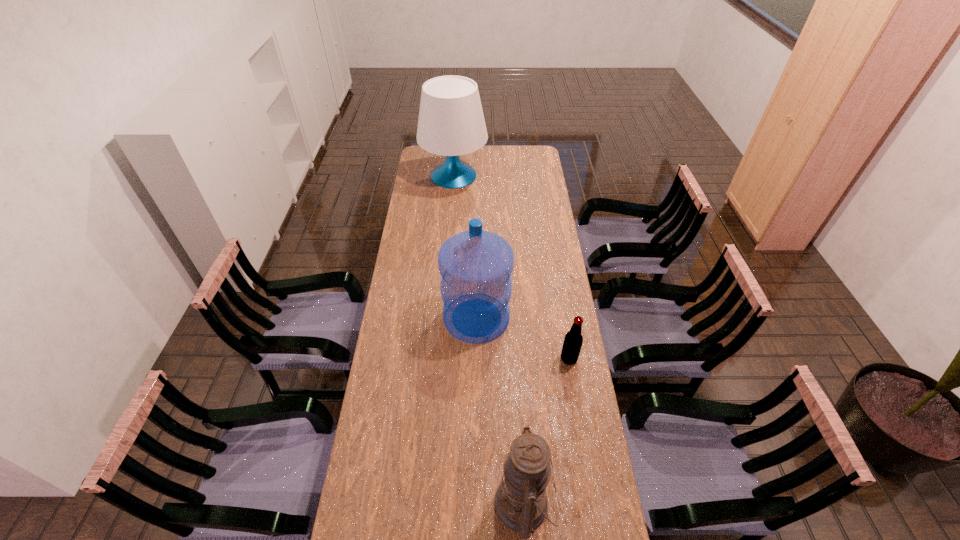
This screenshot has height=540, width=960. Find the location of `object that is at the far left corner`. object that is at the far left corner is located at coordinates (451, 122).

You are a GUI agent. You are given a task and a screenshot of the screen. Output one action in this format:
    pyautogui.click(x=<x>, y=<y>)
    Task: Click on the vacant space at the far edge of the desktop
    
    Given the screenshot: What is the action you would take?
    pyautogui.click(x=471, y=163)

Find the location of a particular element. The image size is (960, 540). free space at the left edge of the desktop is located at coordinates (426, 280).

The height and width of the screenshot is (540, 960). What are the coordinates of `free location at the right edge` in the screenshot? It's located at (563, 282).

Where is `vacant space in between the second farthest object and the third farthest object`? Image resolution: width=960 pixels, height=540 pixels. vacant space in between the second farthest object and the third farthest object is located at coordinates 522,338.

This screenshot has height=540, width=960. In order to click on unoccupied area between the second farthest object and the shortest object in this screenshot , I will do `click(522, 338)`.

I want to click on the third closest object to the second nearest object, so click(x=451, y=122).

Select which object is the third closest to the third farthest object. Please provide its 2D coordinates. Your answer should be formatted as a tuple, i.e. [(x, y)], where the tuple contains the x and y coordinates of a point satisfying the conditions above.

[(451, 122)]

Locate an element on the screen. This screenshot has height=540, width=960. vacant point that satisfies the following two spatial constraints: 1. on the front-facing side of the farthest object; 2. on the right side of the water jug is located at coordinates point(444,318).

Where is `free location that satisfies the following two spatial constraints: 1. on the front-facing side of the water jug; 2. on the left side of the table lamp`? The height and width of the screenshot is (540, 960). free location that satisfies the following two spatial constraints: 1. on the front-facing side of the water jug; 2. on the left side of the table lamp is located at coordinates (444, 318).